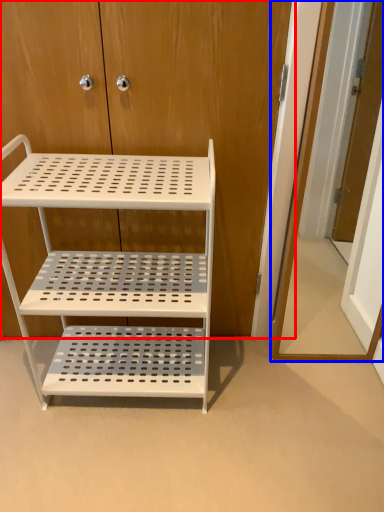
Question: Which object is closer to the camera taking this photo, dresser (highlighted by a red box) or door (highlighted by a blue box)?

Choices:
 (A) dresser
 (B) door

Answer: (B)